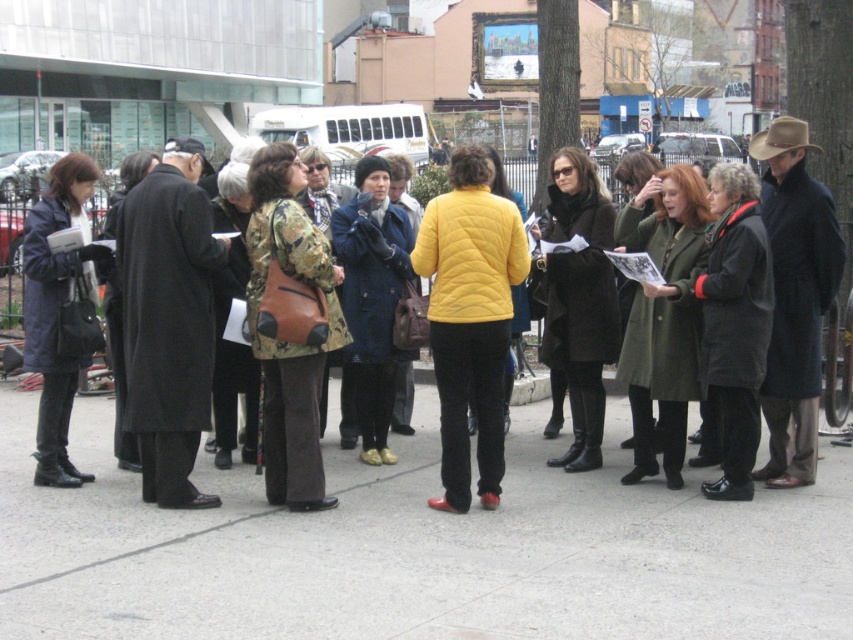
You are a tour guide who wants to walk from the gray concrete pavement at center to the quilted navy coat at left. Can you walk directly from the pavement to the coat without stepping on any other objects?

The gray concrete pavement at center is wider than the quilted navy coat at left, so yes, you can walk directly from the gray concrete pavement at center to the quilted navy coat at left without stepping on other objects.

You are standing at the point marked by the coordinates point (418, 552), which is on the gray concrete pavement at center. You want to walk towards the white bus parked nearby. Which direction should you face to walk directly towards the white bus parked nearby?

The white bus is located to the north of the gray concrete pavement at center, so you should face north to walk directly towards the white bus parked nearby.